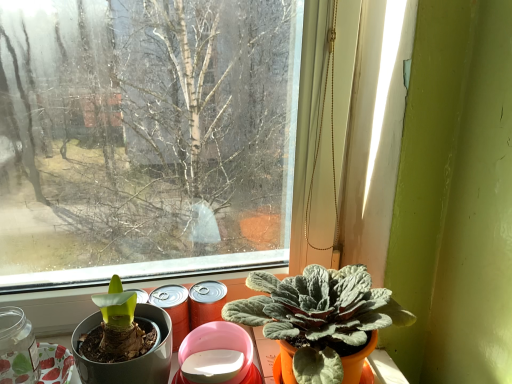
Question: From a real-world perspective, is transparent glass jar at lower left under silvery-green felt-like plant at lower right?

Choices:
 (A) no
 (B) yes

Answer: (B)

Question: From the image's perspective, is transparent glass jar at lower left located above silvery-green felt-like plant at lower right?

Choices:
 (A) no
 (B) yes

Answer: (A)

Question: Is transparent glass jar at lower left at the left side of silvery-green felt-like plant at lower right?

Choices:
 (A) no
 (B) yes

Answer: (B)

Question: From the image's perspective, would you say transparent glass jar at lower left is shown under silvery-green felt-like plant at lower right?

Choices:
 (A) yes
 (B) no

Answer: (A)

Question: From a real-world perspective, is transparent glass jar at lower left physically above silvery-green felt-like plant at lower right?

Choices:
 (A) no
 (B) yes

Answer: (A)

Question: Is transparent glass jar at lower left to the right of silvery-green felt-like plant at lower right from the viewer's perspective?

Choices:
 (A) yes
 (B) no

Answer: (B)

Question: Can you confirm if silvery-green felt-like plant at lower right is bigger than transparent glass jar at lower left?

Choices:
 (A) no
 (B) yes

Answer: (B)

Question: Can you confirm if silvery-green felt-like plant at lower right is smaller than transparent glass jar at lower left?

Choices:
 (A) yes
 (B) no

Answer: (B)

Question: Can you confirm if silvery-green felt-like plant at lower right is positioned to the left of transparent glass jar at lower left?

Choices:
 (A) no
 (B) yes

Answer: (A)

Question: Can you confirm if silvery-green felt-like plant at lower right is thinner than transparent glass jar at lower left?

Choices:
 (A) yes
 (B) no

Answer: (B)

Question: Is silvery-green felt-like plant at lower right closer to camera compared to transparent glass jar at lower left?

Choices:
 (A) yes
 (B) no

Answer: (A)

Question: From a real-world perspective, is silvery-green felt-like plant at lower right positioned over transparent glass jar at lower left based on gravity?

Choices:
 (A) no
 (B) yes

Answer: (B)

Question: Looking at the image, does transparent glass jar at lower left seem bigger or smaller compared to silvery-green felt-like plant at lower right?

Choices:
 (A) small
 (B) big

Answer: (A)